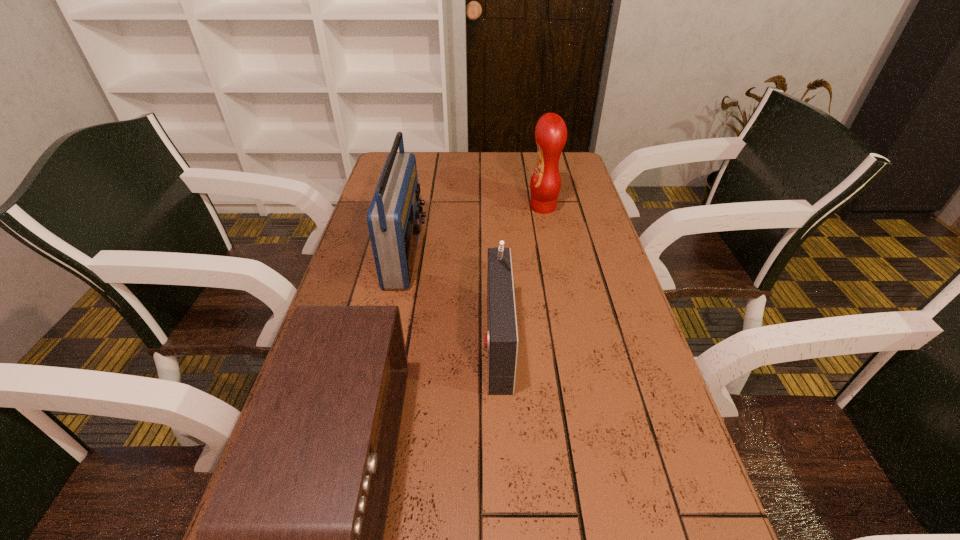
Identify the location of condiment. This screenshot has width=960, height=540. (550, 132).

The image size is (960, 540). Find the location of `the third object from left to right`. the third object from left to right is located at coordinates (501, 340).

Find the location of a particular element. The image size is (960, 540). vacant space situated 0.230m on the label side of the rightmost object is located at coordinates (458, 207).

Where is `vacant space situated 0.380m on the label side of the rightmost object`? vacant space situated 0.380m on the label side of the rightmost object is located at coordinates (413, 207).

Where is `blank area located 0.360m on the label side of the rightmost object`? This screenshot has width=960, height=540. blank area located 0.360m on the label side of the rightmost object is located at coordinates (419, 207).

Find the location of `free space located 0.330m on the front panel of the third object from left to right`. free space located 0.330m on the front panel of the third object from left to right is located at coordinates (341, 338).

Where is `vacant space positioned 0.230m on the front panel of the third object from left to right`? The image size is (960, 540). vacant space positioned 0.230m on the front panel of the third object from left to right is located at coordinates (384, 338).

The width and height of the screenshot is (960, 540). I want to click on free space located 0.210m on the front panel of the third object from left to right, so click(x=393, y=338).

This screenshot has height=540, width=960. Find the location of `object located in the left edge section of the desktop`. object located in the left edge section of the desktop is located at coordinates (394, 218).

Identify the location of object located in the right edge section of the desktop. (550, 132).